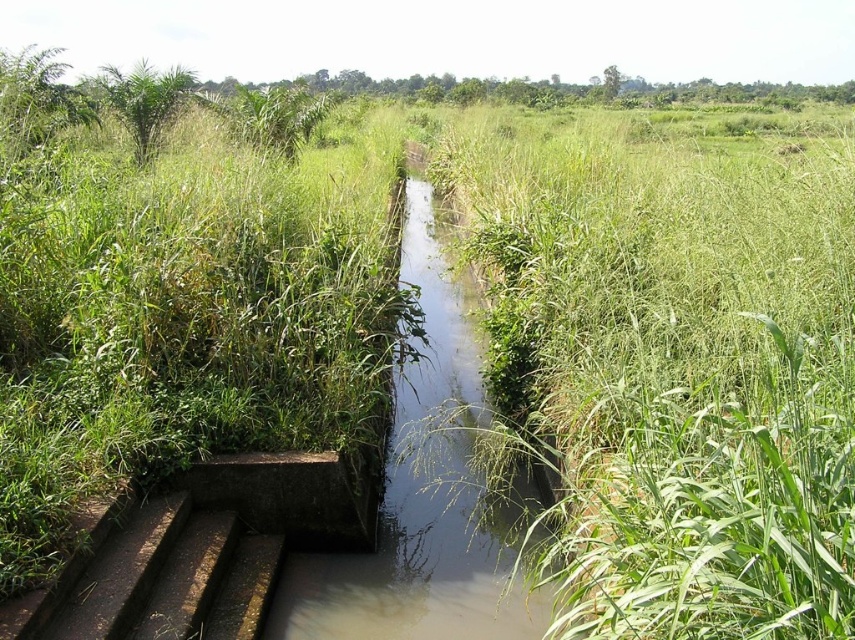
You are a drone operator trying to capture a closeup of the muddy concrete stream at center. Your drone has a maximum safe flying distance of 3 meters. Can you safely fly your drone to the stream?

The distance between the muddy concrete stream at center and the camera is 3.63 meters, which exceeds the drone operator maximum safe flying distance of 3 meters. Therefore, the drone cannot safely fly to the stream.

You are a maintenance worker needing to cross the rusty metal stairs at lower left to reach the muddy concrete stream at center. Based on their positions, which direction should you walk from the stairs to get to the stream?

You should walk to the right from the rusty metal stairs at lower left to reach the muddy concrete stream at center, as the stream is positioned to the right of the stairs.

You are a maintenance worker tasked with inspecting the rusty metal stairs at lower left and the muddy concrete stream at center. Which object should you approach first if you want to start with the one closer to your current position?

You should approach the rusty metal stairs at lower left first because it is closer to you than the muddy concrete stream at center, which is further away.